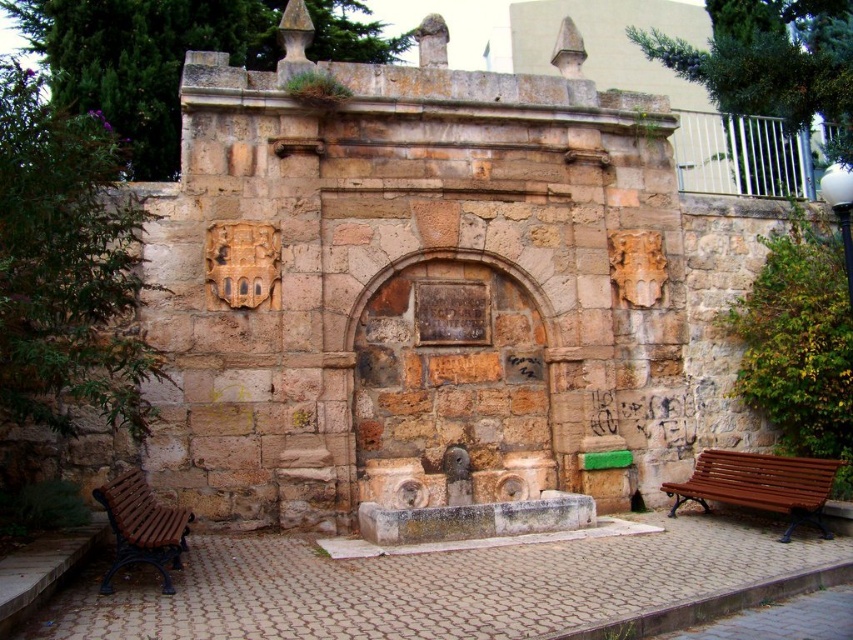
Looking at this image, you are standing in front of the old stone fountain in the public square. There are two points marked on the ground around the fountain at coordinates point (817,497) and point (119,540). If you want to move towards the fountain, which point should you step on first?

You should step on point (119,540) first because it is closer to the fountain than point (817,497), which is further away from the fountain.

You are a visitor sitting on the brown wooden bench at lower left and want to move to the brown wooden bench at lower right. Which direction should you walk to reach it?

The brown wooden bench at lower right is to the right of the brown wooden bench at lower left, so you should walk to the right to reach it.

You are standing at the center of the square and want to sit on the brown wooden bench at lower right. Which direction should you walk to reach it?

You should walk towards the lower right direction to reach the brown wooden bench at lower right since it is located at point [759,484].